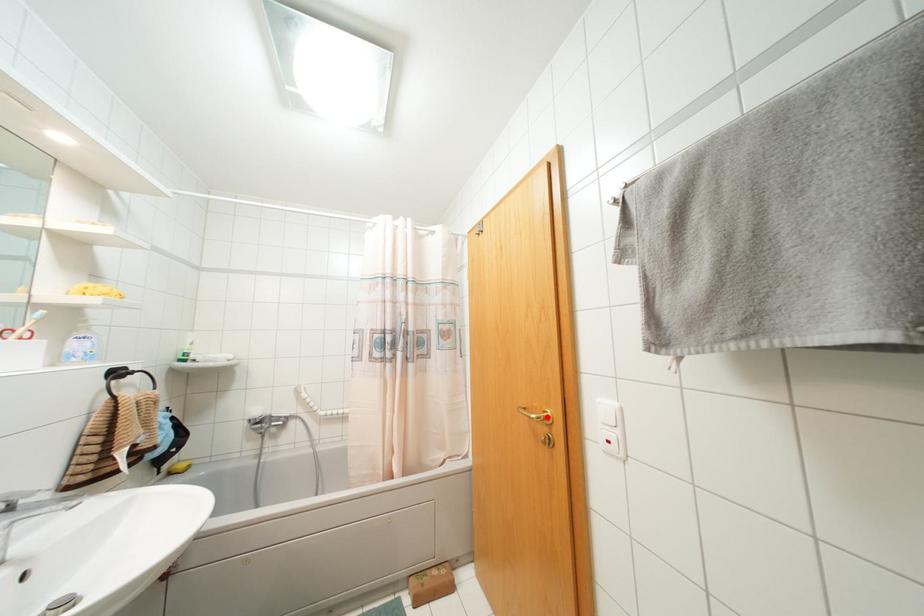
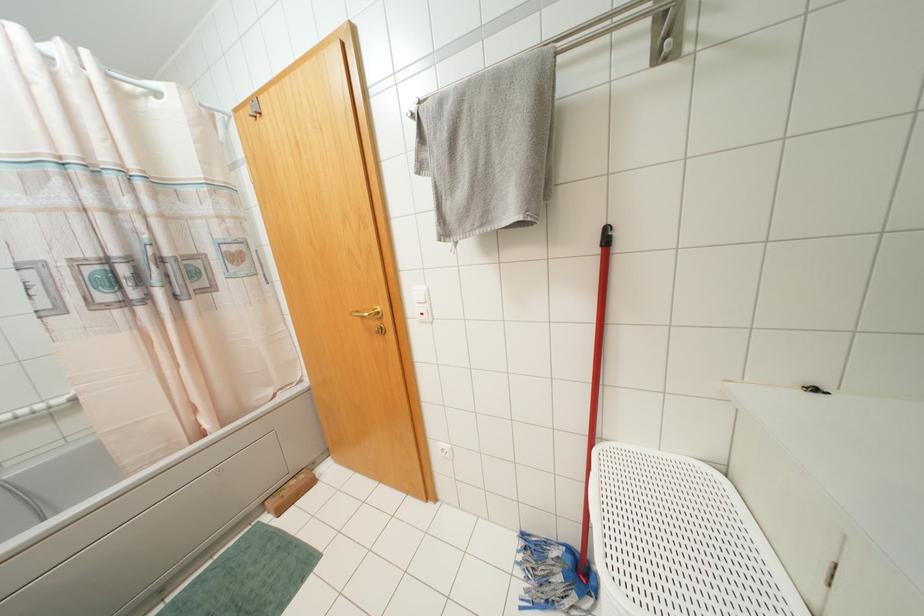
In the second image, find the point that corresponds to the highlighted location in the first image.

(378, 312)